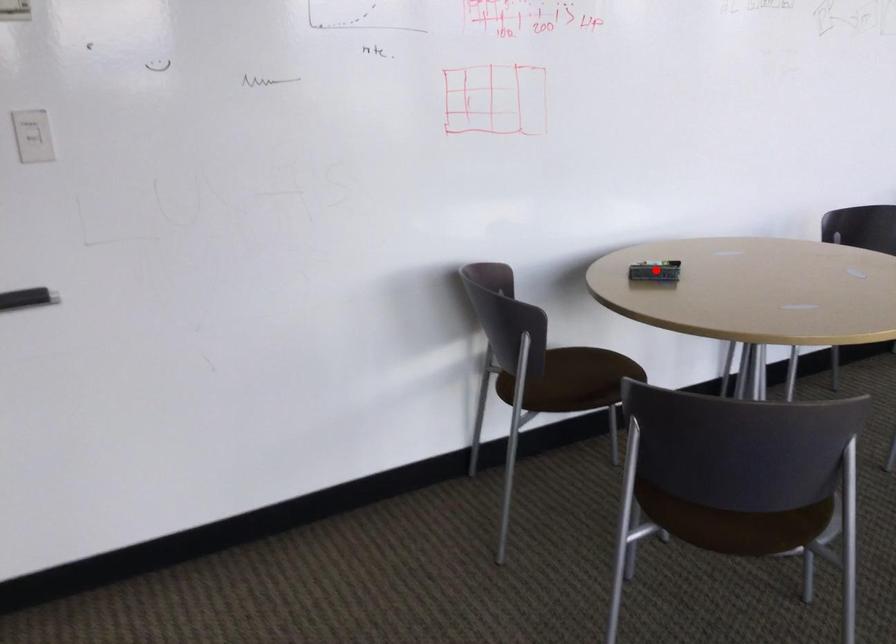
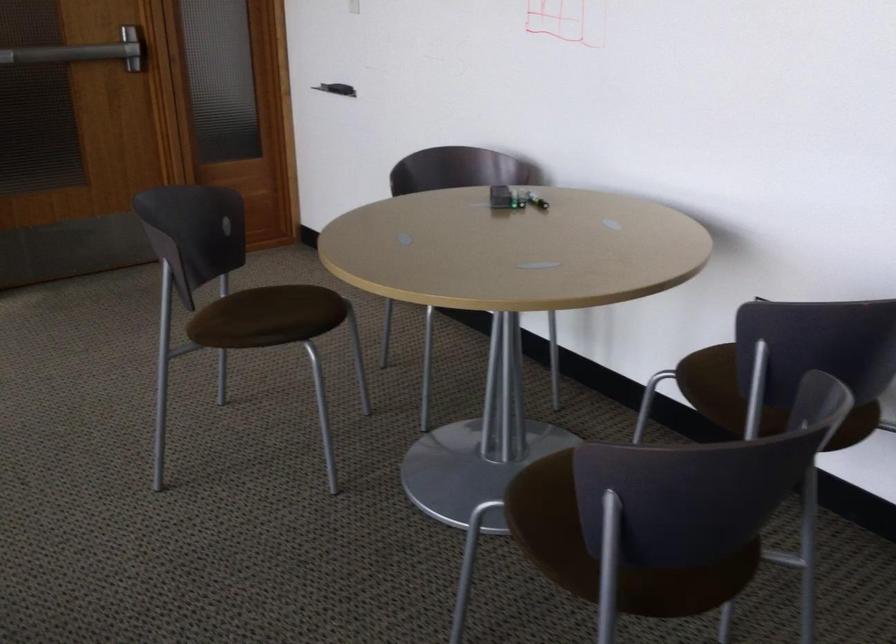
Locate, in the second image, the point that corresponds to the highlighted location in the first image.

(515, 196)